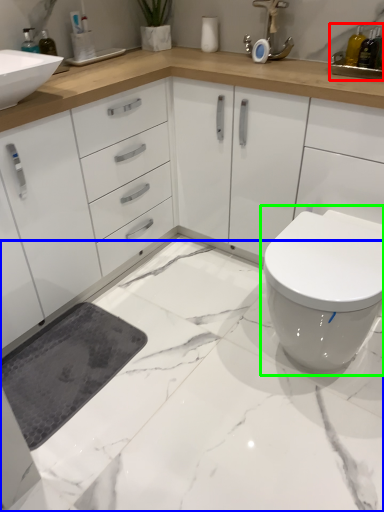
Question: Which is nearer to the sink (highlighted by a red box)? granite (highlighted by a blue box) or toilet (highlighted by a green box).

Choices:
 (A) granite
 (B) toilet

Answer: (B)